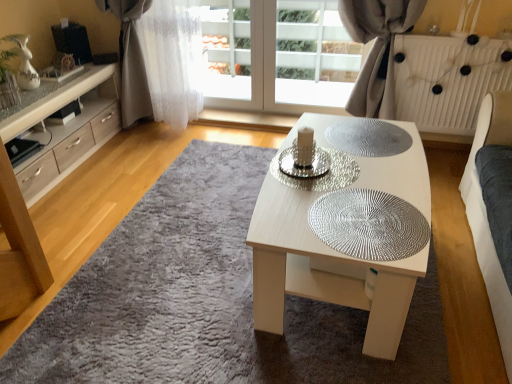
The height and width of the screenshot is (384, 512). What do you see at coordinates (160, 63) in the screenshot?
I see `white sheer curtain at upper left, the 1th curtain in the left-to-right sequence` at bounding box center [160, 63].

The width and height of the screenshot is (512, 384). What do you see at coordinates (207, 300) in the screenshot? I see `silver textured mat at center` at bounding box center [207, 300].

In order to click on silver textured mat at center in this screenshot , I will do `click(207, 300)`.

Describe the element at coordinates (448, 79) in the screenshot. This screenshot has height=384, width=512. I see `white textured radiator at upper right` at that location.

Measure the distance between point [326,183] and camera.

Point [326,183] and camera are 5.56 feet apart.

The height and width of the screenshot is (384, 512). I want to click on white wood coffee table at center, so click(321, 273).

From a real-world perspective, does white sheer curtain at upper left, which is the 2th curtain from right to left, sit lower than silver textured mat at center?

No, from a real-world perspective, white sheer curtain at upper left, which is the 2th curtain from right to left, is not beneath silver textured mat at center.

Does point (136, 76) appear closer or farther from the camera than point (312, 328)?

Clearly, point (136, 76) is more distant from the camera than point (312, 328).

Does white sheer curtain at upper left, the 1th curtain in the left-to-right sequence, turn towards silver textured mat at center?

No, white sheer curtain at upper left, the 1th curtain in the left-to-right sequence, does not turn towards silver textured mat at center.

Looking at this image, is white sheer curtain at upper left, the 1th curtain in the left-to-right sequence, inside or outside of silver textured mat at center?

white sheer curtain at upper left, the 1th curtain in the left-to-right sequence, exists outside the volume of silver textured mat at center.

From a real-world perspective, which is physically above, silver textured glass plate at center, marked as the third glass plate in a front-to-back arrangement, or silver textured mat at center?

silver textured glass plate at center, marked as the third glass plate in a front-to-back arrangement.

Which point is more distant from viewer, (347,121) or (131,343)?

The point (347,121) is farther from the camera.

Is silver textured glass plate at center, marked as the third glass plate in a front-to-back arrangement, shorter than silver textured mat at center?

Yes, silver textured glass plate at center, marked as the third glass plate in a front-to-back arrangement, is shorter than silver textured mat at center.

Could you tell me if silver textured glass plate at center, positioned as the first glass plate in back-to-front order, is turned towards silver textured mat at center?

No, silver textured glass plate at center, positioned as the first glass plate in back-to-front order, is not facing towards silver textured mat at center.

Is silver textured glass plate at center, marked as the third glass plate in a front-to-back arrangement, completely or partially outside of white fabric curtain at upper center, placed as the second curtain when sorted from left to right?

silver textured glass plate at center, marked as the third glass plate in a front-to-back arrangement, is positioned outside white fabric curtain at upper center, placed as the second curtain when sorted from left to right.

Are silver textured glass plate at center, positioned as the first glass plate in back-to-front order, and white fabric curtain at upper center, arranged as the 1th curtain when viewed from the right, located far from each other?

silver textured glass plate at center, positioned as the first glass plate in back-to-front order, is near white fabric curtain at upper center, arranged as the 1th curtain when viewed from the right, not far away.

At what (x,y) coordinates should I click in order to perform the action: click on the 1st glass plate in front when counting from the white fabric curtain at upper center, arranged as the 1th curtain when viewed from the right. Please return your answer as a coordinate pair (x, y). Looking at the image, I should click on (368, 137).

Consider the image. From the image's perspective, between light wood cabinet at left and white sheer curtain at upper left, the 1th curtain in the left-to-right sequence, which one is located above?

white sheer curtain at upper left, the 1th curtain in the left-to-right sequence, from the image's perspective.

Does light wood cabinet at left have a smaller size compared to white sheer curtain at upper left, the 1th curtain in the left-to-right sequence?

No.

Is point (46, 183) farther from camera compared to point (146, 16)?

No, it is not.

Locate an element on the screen. cabinetry that is in front of the white sheer curtain at upper left, the 1th curtain in the left-to-right sequence is located at coordinates (65, 130).

Consider the image. From a real-world perspective, is silver textured mat at center physically below silver textured glass plate at center, arranged as the 3th glass plate when viewed from the back?

Yes, from a real-world perspective, silver textured mat at center is below silver textured glass plate at center, arranged as the 3th glass plate when viewed from the back.

Can silver textured glass plate at center, arranged as the 3th glass plate when viewed from the back, be found inside silver textured mat at center?

No, silver textured glass plate at center, arranged as the 3th glass plate when viewed from the back, is not a part of silver textured mat at center.

Is silver textured mat at center next to silver textured glass plate at center, the first glass plate when ordered from front to back?

No.

Which object is positioned more to the right, silver textured mat at center or silver textured glass plate at center, the first glass plate when ordered from front to back?

From the viewer's perspective, silver textured glass plate at center, the first glass plate when ordered from front to back, appears more on the right side.

Is white textured radiator at upper right surrounded by silver textured glass plate at center, arranged as the 3th glass plate when viewed from the back?

No.

Considering the relative sizes of silver textured glass plate at center, the first glass plate when ordered from front to back, and white textured radiator at upper right in the image provided, is silver textured glass plate at center, the first glass plate when ordered from front to back, taller than white textured radiator at upper right?

Incorrect, the height of silver textured glass plate at center, the first glass plate when ordered from front to back, is not larger of that of white textured radiator at upper right.

From a real-world perspective, is silver textured glass plate at center, the first glass plate when ordered from front to back, positioned over white textured radiator at upper right based on gravity?

Yes.

This screenshot has width=512, height=384. What are the coordinates of `the 1st curtain behind the light wood cabinet at left, counting from the anchor's position` in the screenshot? It's located at (377, 50).

Is white fabric curtain at upper center, arranged as the 1th curtain when viewed from the right, situated inside light wood cabinet at left or outside?

white fabric curtain at upper center, arranged as the 1th curtain when viewed from the right, is outside light wood cabinet at left.

From the image's perspective, is white fabric curtain at upper center, arranged as the 1th curtain when viewed from the right, above or below light wood cabinet at left?

Clearly, from the image's perspective, white fabric curtain at upper center, arranged as the 1th curtain when viewed from the right, is above light wood cabinet at left.

Is white fabric curtain at upper center, arranged as the 1th curtain when viewed from the right, placed right next to light wood cabinet at left?

There is a gap between white fabric curtain at upper center, arranged as the 1th curtain when viewed from the right, and light wood cabinet at left.

What are the coordinates of `the 2nd curtain above when counting from the silver textured mat at center (from the image's perspective)` in the screenshot? It's located at (160, 63).

At what (x,y) coordinates should I click in order to perform the action: click on mat below the silver textured glass plate at center, positioned as the first glass plate in back-to-front order (from a real-world perspective). Please return your answer as a coordinate pair (x, y). Image resolution: width=512 pixels, height=384 pixels. Looking at the image, I should click on (207, 300).

Based on their spatial positions, is silver textured glass plate at center, the 2th glass plate in the front-to-back sequence, or silver textured glass plate at center, marked as the third glass plate in a front-to-back arrangement, further from silver textured mat at center?

The object further to silver textured mat at center is silver textured glass plate at center, marked as the third glass plate in a front-to-back arrangement.

From the image, which object appears to be farther from silver textured glass plate at center, marked as the third glass plate in a front-to-back arrangement, silver textured glass plate at center, the second glass plate when ordered from back to front, or white sheer curtain at upper left, which is the 2th curtain from right to left?

white sheer curtain at upper left, which is the 2th curtain from right to left, lies further to silver textured glass plate at center, marked as the third glass plate in a front-to-back arrangement, than the other object.

From the image, which object appears to be farther from silver textured mat at center, light wood cabinet at left or white wood coffee table at center?

light wood cabinet at left is positioned further to the anchor silver textured mat at center.

Based on their spatial positions, is white sheer curtain at upper left, the 1th curtain in the left-to-right sequence, or silver textured glass plate at center, the second glass plate when ordered from back to front, closer to silver textured glass plate at center, arranged as the 3th glass plate when viewed from the back?

The object closer to silver textured glass plate at center, arranged as the 3th glass plate when viewed from the back, is silver textured glass plate at center, the second glass plate when ordered from back to front.

When comparing their distances from light wood cabinet at left, does silver textured glass plate at center, marked as the third glass plate in a front-to-back arrangement, or silver textured glass plate at center, the 2th glass plate in the front-to-back sequence, seem further?

silver textured glass plate at center, marked as the third glass plate in a front-to-back arrangement.

Based on their spatial positions, is white fabric curtain at upper center, arranged as the 1th curtain when viewed from the right, or silver textured glass plate at center, positioned as the first glass plate in back-to-front order, further from white textured radiator at upper right?

silver textured glass plate at center, positioned as the first glass plate in back-to-front order, is further to white textured radiator at upper right.

When comparing their distances from light wood cabinet at left, does white textured radiator at upper right or white sheer curtain at upper left, the 1th curtain in the left-to-right sequence, seem further?

white textured radiator at upper right.

From the image, which object appears to be farther from white textured radiator at upper right, silver textured glass plate at center, arranged as the 3th glass plate when viewed from the back, or light wood cabinet at left?

Based on the image, light wood cabinet at left appears to be further to white textured radiator at upper right.

At what (x,y) coordinates should I click in order to perform the action: click on cabinetry between silver textured mat at center and white sheer curtain at upper left, which is the 2th curtain from right to left, from front to back. Please return your answer as a coordinate pair (x, y). Looking at the image, I should click on (65, 130).

What are the coordinates of `curtain between silver textured mat at center and white sheer curtain at upper left, the 1th curtain in the left-to-right sequence, along the z-axis` in the screenshot? It's located at (377, 50).

Locate an element on the screen. glass plate between silver textured glass plate at center, arranged as the 3th glass plate when viewed from the back, and silver textured glass plate at center, marked as the third glass plate in a front-to-back arrangement, in the front-back direction is located at coordinates (322, 175).

Where is `coffee table situated between light wood cabinet at left and silver textured glass plate at center, marked as the third glass plate in a front-to-back arrangement, from left to right`? Image resolution: width=512 pixels, height=384 pixels. coffee table situated between light wood cabinet at left and silver textured glass plate at center, marked as the third glass plate in a front-to-back arrangement, from left to right is located at coordinates (321, 273).